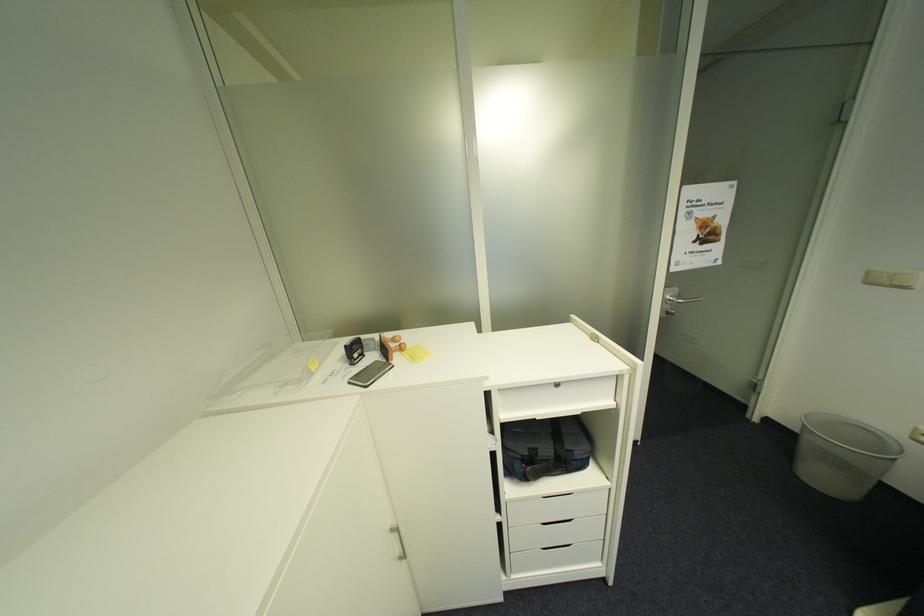
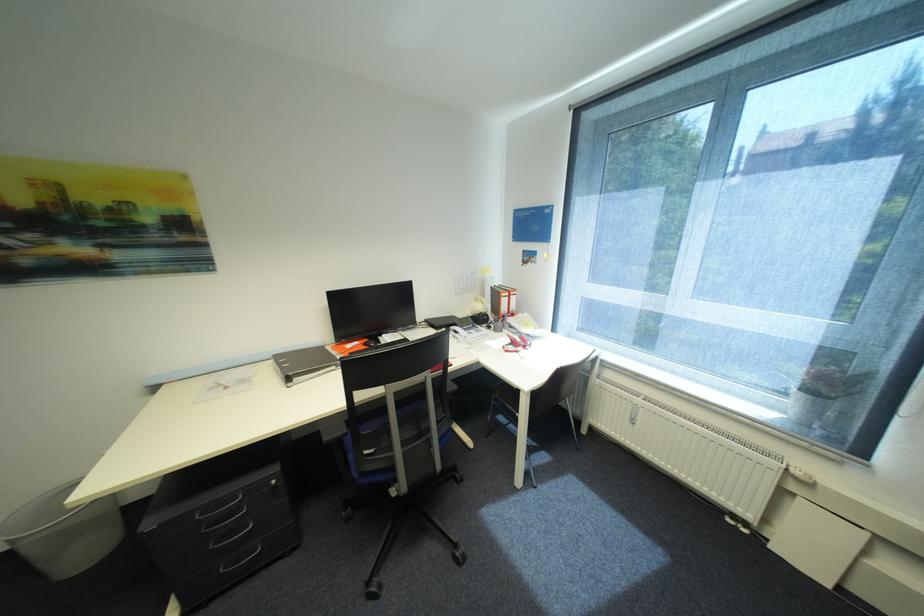
In the second image, find the point that corresponds to (x=805, y=429) in the first image.

(14, 548)